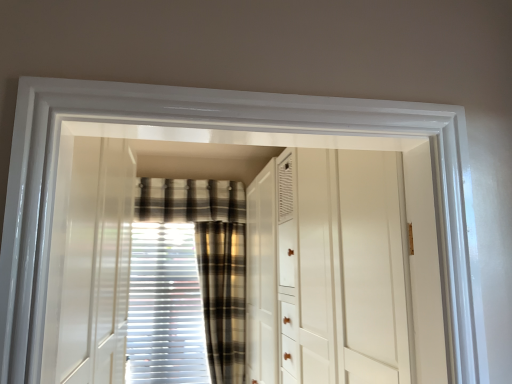
Question: Is white textured blinds at center, acting as the 1th curtain starting from the left, inside or outside of plaid fabric curtain at center, the first curtain from the right?

Choices:
 (A) inside
 (B) outside

Answer: (B)

Question: Considering their positions, is white textured blinds at center, the 2th curtain when ordered from right to left, located in front of or behind plaid fabric curtain at center, the first curtain from the right?

Choices:
 (A) front
 (B) behind

Answer: (B)

Question: Which is nearer to the white glossy dresser at center?

Choices:
 (A) white textured blinds at center, acting as the 1th curtain starting from the left
 (B) plaid fabric at center
 (C) plaid fabric curtain at center, which is the 2th curtain in left-to-right order

Answer: (C)

Question: Considering the real-world distances, which object is closest to the white textured blinds at center, the 2th curtain when ordered from right to left?

Choices:
 (A) plaid fabric curtain at center, which is the 2th curtain in left-to-right order
 (B) plaid fabric at center
 (C) white glossy dresser at center

Answer: (A)